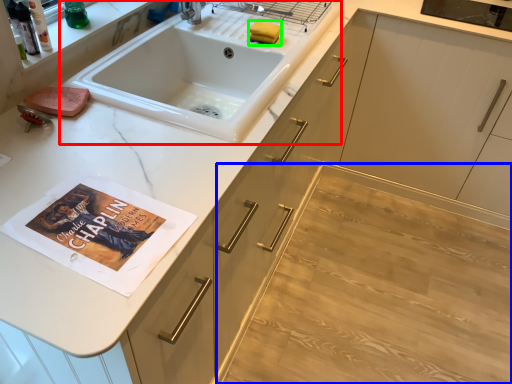
Question: Estimate the real-world distances between objects in this image. Which object is farther from sink (highlighted by a red box), plain (highlighted by a blue box) or soap (highlighted by a green box)?

Choices:
 (A) plain
 (B) soap

Answer: (A)